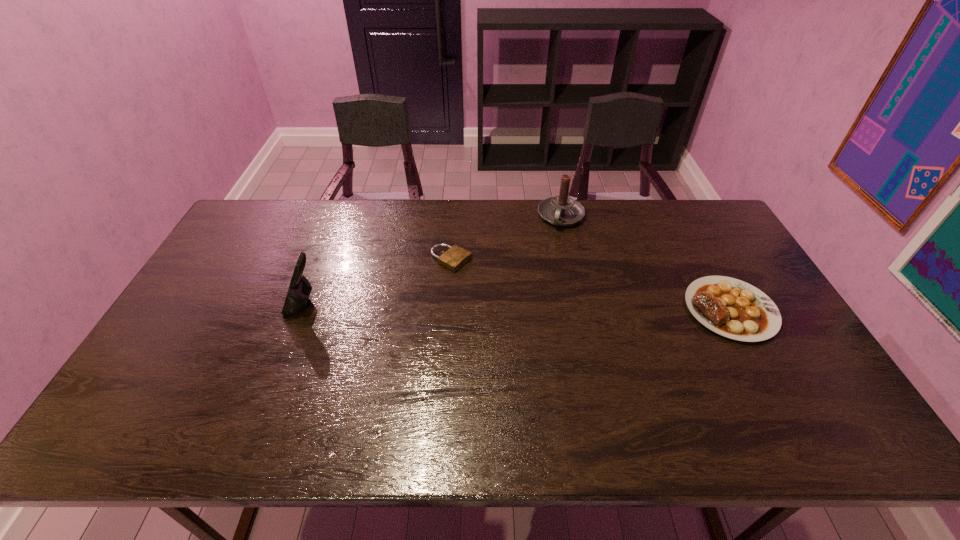
At what (x,y) coordinates should I click in order to perform the action: click on free space between the third object from right to left and the rightmost object. Please return your answer as a coordinate pair (x, y). Looking at the image, I should click on (590, 285).

The height and width of the screenshot is (540, 960). I want to click on free spot between the leftmost object and the second farthest object, so click(377, 282).

Find the location of a particular element. vacant area that lies between the shortest object and the cellular telephone is located at coordinates (377, 282).

Find the location of `empty location between the candle and the second shortest object`. empty location between the candle and the second shortest object is located at coordinates tap(646, 263).

The height and width of the screenshot is (540, 960). In order to click on object that is the third closest to the second object from right to left in this screenshot , I will do `click(299, 291)`.

Identify the location of the third closest object to the shortest object. This screenshot has width=960, height=540. (732, 308).

Locate an element on the screen. This screenshot has height=540, width=960. vacant space that satisfies the following two spatial constraints: 1. on the front side of the third nearest object; 2. on the left side of the steak is located at coordinates pyautogui.click(x=447, y=309).

The height and width of the screenshot is (540, 960). Find the location of `free space that satisfies the following two spatial constraints: 1. on the front side of the third tallest object; 2. on the left side of the third object from right to left`. free space that satisfies the following two spatial constraints: 1. on the front side of the third tallest object; 2. on the left side of the third object from right to left is located at coordinates (447, 309).